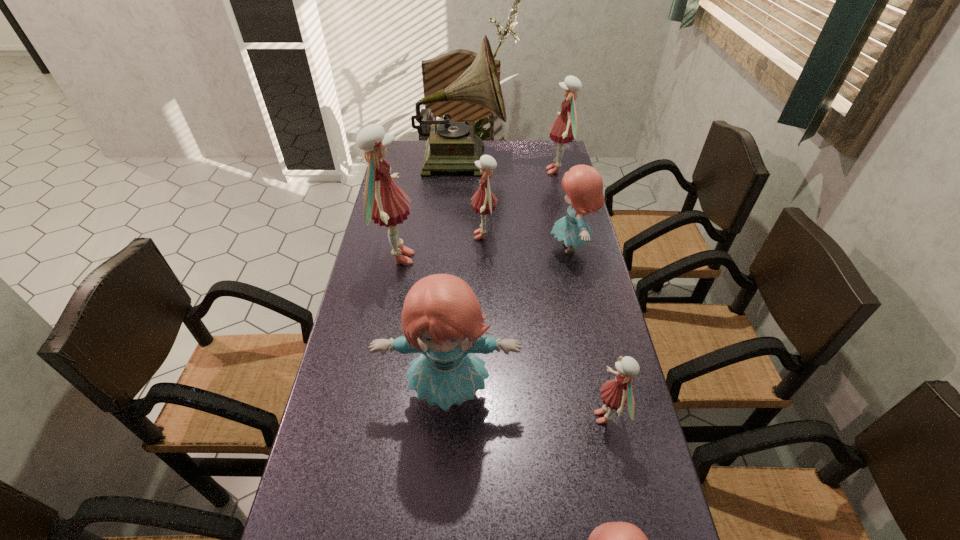
I want to click on vacant space at the left edge of the desktop, so (388, 285).

Identify the location of free space at the right edge. (547, 183).

In the image, there is a desktop. What are the coordinates of `free space at the far right corner` in the screenshot? It's located at (529, 151).

This screenshot has height=540, width=960. I want to click on free space between the second smallest blue doll and the record player, so click(516, 204).

The width and height of the screenshot is (960, 540). Identify the location of free space between the farthest pink doll and the biggest blue doll. (503, 282).

Where is `free space between the farthest blue doll and the leftmost blue doll`? The height and width of the screenshot is (540, 960). free space between the farthest blue doll and the leftmost blue doll is located at coordinates (510, 320).

Where is `empty location between the second biggest blue doll and the record player`? The image size is (960, 540). empty location between the second biggest blue doll and the record player is located at coordinates (516, 204).

Where is `free area in between the biggest blue doll and the farthest blue doll`? This screenshot has height=540, width=960. free area in between the biggest blue doll and the farthest blue doll is located at coordinates (510, 320).

Find the location of a particular element. Image resolution: width=960 pixels, height=540 pixels. vacant area that lies between the farthest doll and the leftmost blue doll is located at coordinates (503, 282).

At what (x,y) coordinates should I click in order to perform the action: click on free space between the nearest pink doll and the tallest doll. Please return your answer as a coordinate pair (x, y). The image size is (960, 540). Looking at the image, I should click on (502, 338).